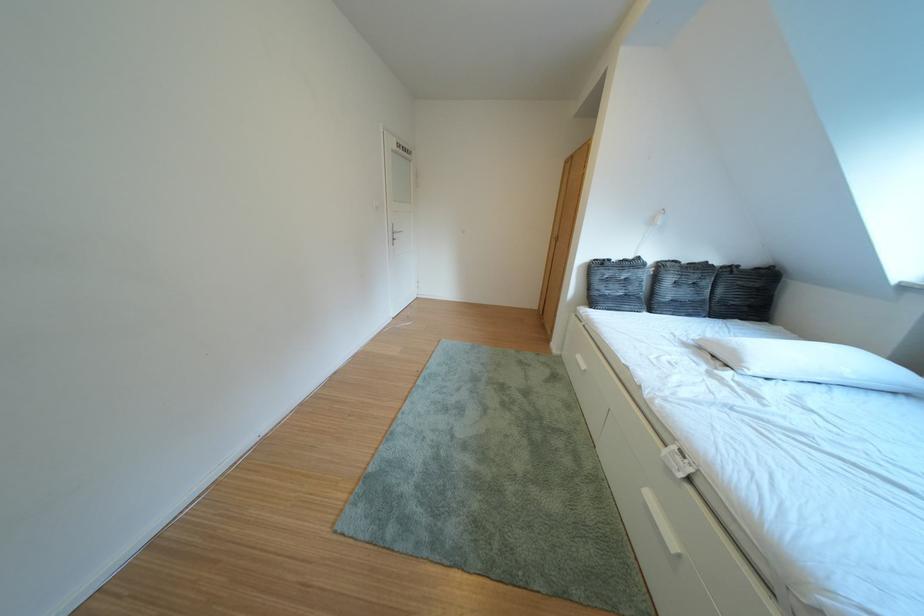
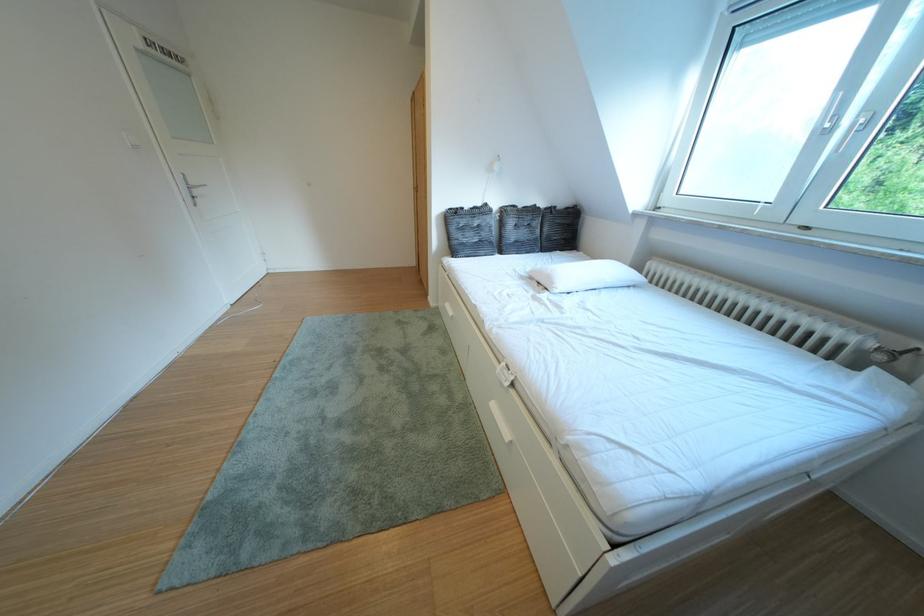
Question: I am providing you with two images of the same scene from different viewpoints. Which of the following objects are not visible in image2?

Choices:
 (A) white window handle
 (B) radiator valve
 (C) grey woven basket
 (D) none of these

Answer: (D)